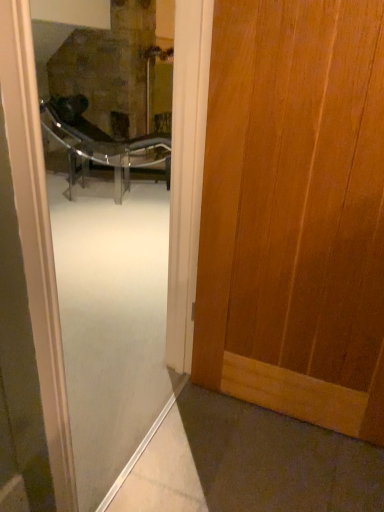
Consider the image. In order to face transparent glass screen door at center, should I rotate leftwards or rightwards?

You should look left and rotate roughly 7.974 degrees.

The image size is (384, 512). I want to click on transparent glass screen door at center, so click(x=91, y=234).

Does point (37, 254) come farther from viewer compared to point (358, 405)?

No, it is not.

Can you confirm if transparent glass screen door at center is shorter than wooden door at right?

No.

Looking at this image, is transparent glass screen door at center to the right of wooden door at right from the viewer's perspective?

No.

From the image's perspective, is transparent glass screen door at center located above wooden door at right?

Incorrect, from the image's perspective, transparent glass screen door at center is lower than wooden door at right.

Is wooden door at right not within transparent glass screen door at center?

Yes, wooden door at right is located beyond the bounds of transparent glass screen door at center.

From a real-world perspective, who is located lower, wooden door at right or transparent glass screen door at center?

transparent glass screen door at center.

Consider the image. Is wooden door at right not close to transparent glass screen door at center?

wooden door at right is positioned a significant distance from transparent glass screen door at center.

From the image's perspective, which is below, transparent glass screen door at center or metallic glass chair at center?

transparent glass screen door at center.

Does transparent glass screen door at center have a larger size compared to metallic glass chair at center?

Incorrect, transparent glass screen door at center is not larger than metallic glass chair at center.

Considering the positions of point (44, 125) and point (229, 275), is point (44, 125) closer or farther from the camera than point (229, 275)?

Point (44, 125) is positioned farther from the camera compared to point (229, 275).

Which is correct: metallic glass chair at center is inside wooden door at right, or outside of it?

metallic glass chair at center exists outside the volume of wooden door at right.

Identify the location of chair below the wooden door at right (from a real-world perspective). (103, 147).

Locate an element on the screen. Image resolution: width=384 pixels, height=512 pixels. chair directly beneath the transparent glass screen door at center (from a real-world perspective) is located at coordinates (103, 147).

From the picture: Is metallic glass chair at center aimed at transparent glass screen door at center?

No, metallic glass chair at center does not turn towards transparent glass screen door at center.

Between metallic glass chair at center and transparent glass screen door at center, which one is positioned in front?

transparent glass screen door at center is in front.

Measure the distance between metallic glass chair at center and transparent glass screen door at center.

9.31 inches.

Considering the positions of objects wooden door at right and metallic glass chair at center in the image provided, who is more to the left, wooden door at right or metallic glass chair at center?

Positioned to the left is metallic glass chair at center.

Which is behind, point (304, 290) or point (75, 165)?

The point (75, 165) is farther.

Is wooden door at right aimed at metallic glass chair at center?

No, wooden door at right does not turn towards metallic glass chair at center.

From their relative heights in the image, would you say wooden door at right is taller or shorter than metallic glass chair at center?

Clearly, wooden door at right is taller compared to metallic glass chair at center.

Where is `screen door to the left of wooden door at right`? screen door to the left of wooden door at right is located at coordinates (91, 234).

You are a GUI agent. You are given a task and a screenshot of the screen. Output one action in this format:
    pyautogui.click(x=<x>, y=<y>)
    Task: Click on the door above the transparent glass screen door at center (from a real-world perspective)
    Image resolution: width=384 pixels, height=512 pixels.
    Given the screenshot: What is the action you would take?
    pyautogui.click(x=295, y=212)

Looking at the image, which one is located closer to metallic glass chair at center, wooden door at right or transparent glass screen door at center?

transparent glass screen door at center is closer to metallic glass chair at center.

When comparing their distances from transparent glass screen door at center, does wooden door at right or metallic glass chair at center seem closer?

metallic glass chair at center.

When comparing their distances from wooden door at right, does transparent glass screen door at center or metallic glass chair at center seem further?

Based on the image, metallic glass chair at center appears to be further to wooden door at right.

Based on their spatial positions, is transparent glass screen door at center or wooden door at right further from metallic glass chair at center?

wooden door at right is further to metallic glass chair at center.

From the image, which object appears to be nearer to wooden door at right, metallic glass chair at center or transparent glass screen door at center?

transparent glass screen door at center lies closer to wooden door at right than the other object.

Considering their positions, is metallic glass chair at center positioned further to transparent glass screen door at center than wooden door at right?

The object further to transparent glass screen door at center is wooden door at right.

The height and width of the screenshot is (512, 384). What are the coordinates of `door located between transparent glass screen door at center and metallic glass chair at center in the depth direction` in the screenshot? It's located at (295, 212).